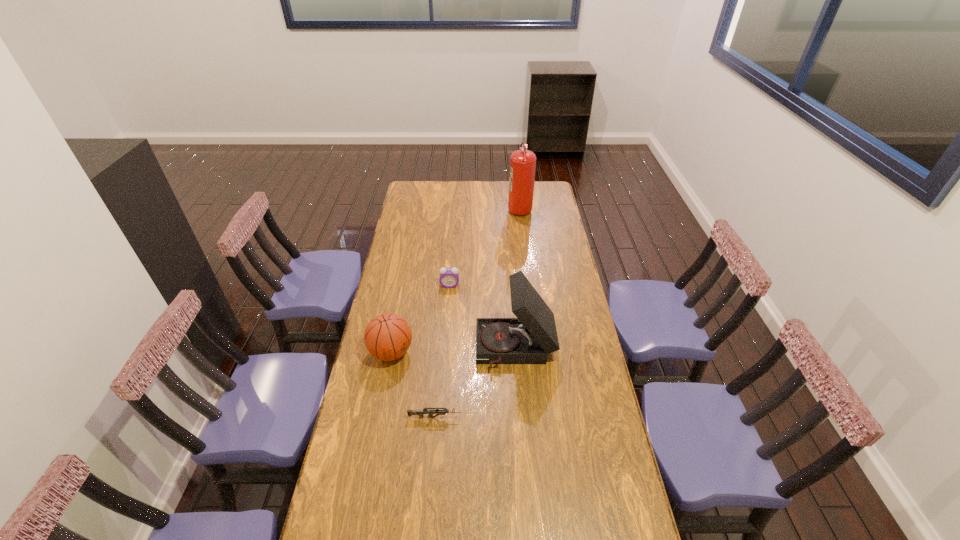
What are the coordinates of `empty space between the phonograph_record and the second shortest object` in the screenshot? It's located at (483, 318).

The image size is (960, 540). Identify the location of free space that is in between the phonograph_record and the alarm clock. (483, 318).

Where is `vacant area that lies between the gun and the basketball`? vacant area that lies between the gun and the basketball is located at coordinates (413, 385).

The width and height of the screenshot is (960, 540). Identify the location of object that is the third nearest to the shortest object. click(x=449, y=277).

Where is `object that stands as the fourth closest to the gun`? The image size is (960, 540). object that stands as the fourth closest to the gun is located at coordinates (523, 162).